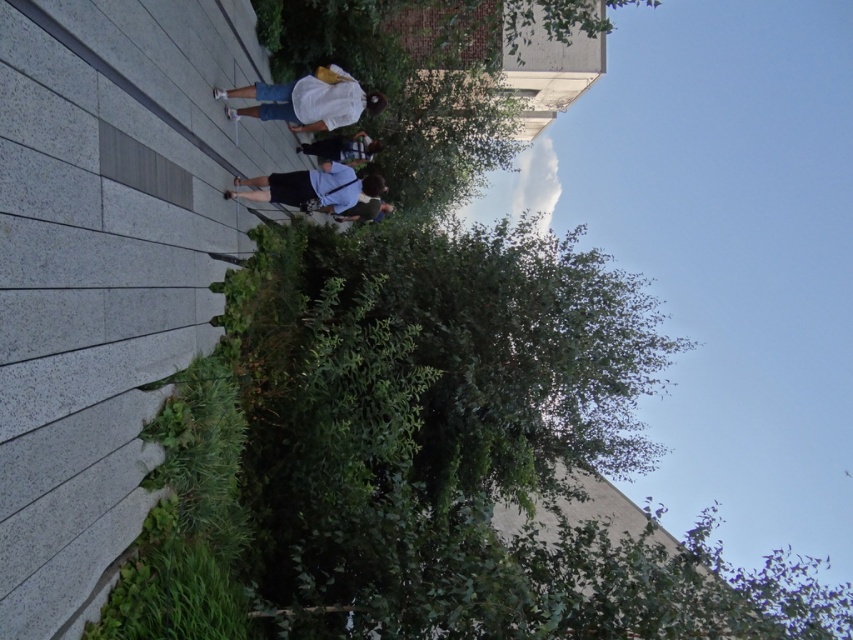
You are a photographer setting up a tripod in the middle of the walkway. You have two items in your bag, the dark blue jeans at center and the blue denim shorts at center. Which item would you choose to place on the tripod if you want to ensure it doesn

The dark blue jeans at center occupies less space than the blue denim shorts at center, so you should choose the dark blue jeans at center to place on the tripod since it takes up less space and would be more stable.

You are standing on the paved walkway and want to move from the dark blue jeans at center to the blue denim shorts at center. Which direction should you move to reach them?

You should move to the right to reach the blue denim shorts at center because the dark blue jeans at center is to the left of the blue denim shorts at center.